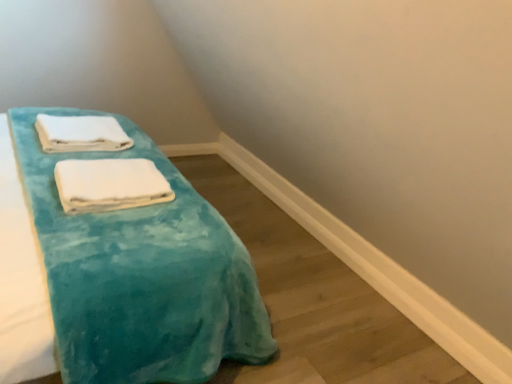
Question: Is white soft towel at center, marked as the 1th towel in a front-to-back arrangement, a part of white soft towel at upper left, which is the 1th towel from back to front?

Choices:
 (A) yes
 (B) no

Answer: (B)

Question: Does white soft towel at upper left, which is the 2th towel from front to back, have a greater height compared to white soft towel at center, which is the second towel in top-to-bottom order?

Choices:
 (A) no
 (B) yes

Answer: (B)

Question: Is white soft towel at upper left, which is the 1th towel from back to front, to the right of white soft towel at center, arranged as the first towel when ordered from the bottom, from the viewer's perspective?

Choices:
 (A) yes
 (B) no

Answer: (B)

Question: From a real-world perspective, is white soft towel at upper left, marked as the first towel in a top-to-bottom arrangement, positioned over white soft towel at center, arranged as the first towel when ordered from the bottom, based on gravity?

Choices:
 (A) yes
 (B) no

Answer: (A)

Question: Considering the relative positions of white soft towel at upper left, which is the 1th towel from back to front, and white soft towel at center, which appears as the second towel when viewed from the back, in the image provided, is white soft towel at upper left, which is the 1th towel from back to front, to the left of white soft towel at center, which appears as the second towel when viewed from the back, from the viewer's perspective?

Choices:
 (A) yes
 (B) no

Answer: (A)

Question: Is white soft towel at upper left, which is the 1th towel from back to front, bigger than white soft towel at center, which is the second towel in top-to-bottom order?

Choices:
 (A) no
 (B) yes

Answer: (B)

Question: Can you confirm if turquoise soft towel at center is wider than white soft towel at upper left, which is the 2th towel from front to back?

Choices:
 (A) no
 (B) yes

Answer: (B)

Question: Is turquoise soft towel at center directly adjacent to white soft towel at upper left, which is the 1th towel from back to front?

Choices:
 (A) yes
 (B) no

Answer: (B)

Question: Is turquoise soft towel at center positioned with its back to white soft towel at upper left, marked as the first towel in a top-to-bottom arrangement?

Choices:
 (A) no
 (B) yes

Answer: (B)

Question: Can you confirm if turquoise soft towel at center is bigger than white soft towel at upper left, which is the 2th towel from front to back?

Choices:
 (A) no
 (B) yes

Answer: (B)

Question: Is turquoise soft towel at center at the right side of white soft towel at upper left, which is the 1th towel from back to front?

Choices:
 (A) no
 (B) yes

Answer: (B)

Question: From the image's perspective, is turquoise soft towel at center above white soft towel at upper left, placed as the second towel when sorted from bottom to top?

Choices:
 (A) no
 (B) yes

Answer: (A)

Question: Does white soft towel at upper left, which is the 2th towel from front to back, have a smaller size compared to turquoise soft towel at center?

Choices:
 (A) no
 (B) yes

Answer: (B)